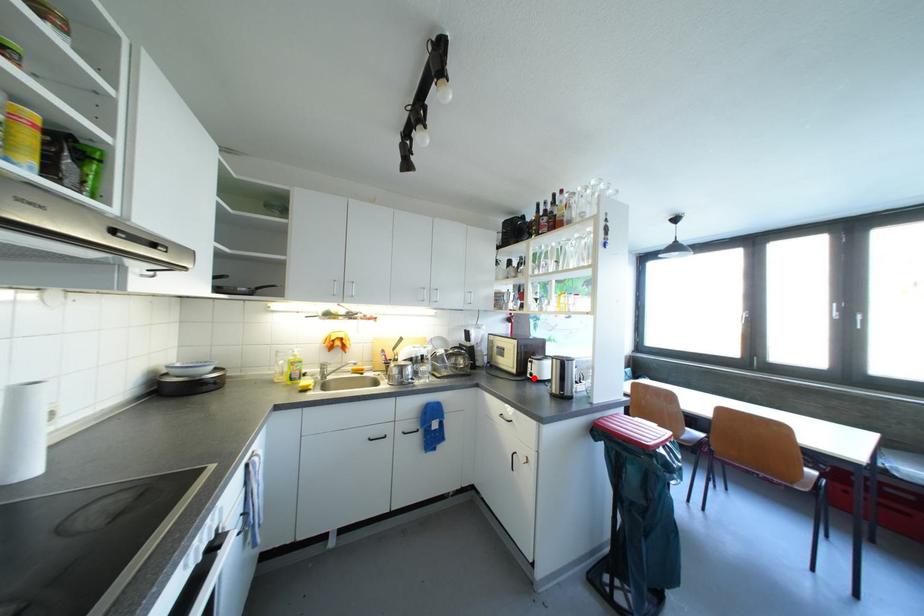
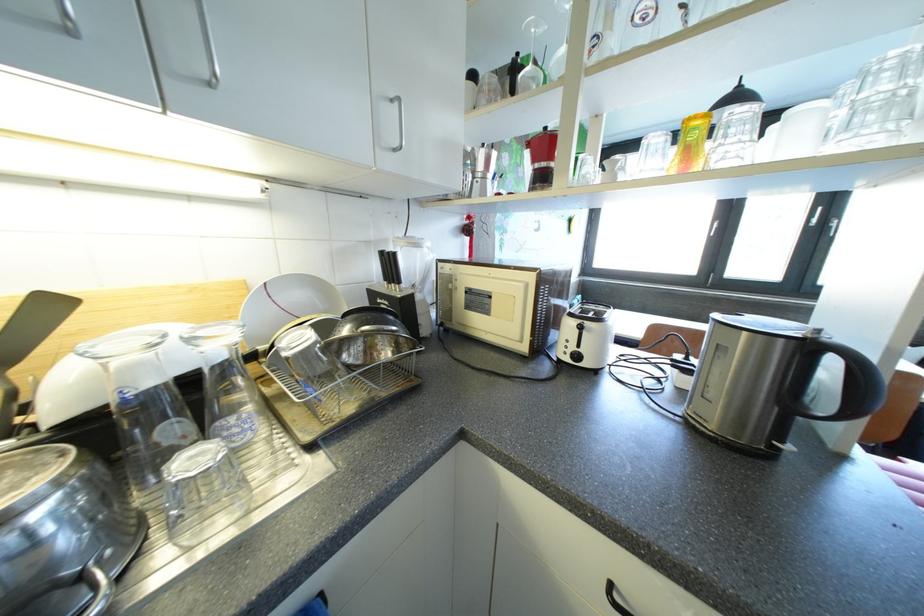
Locate, in the second image, the point that corresponds to the highlighted location in the first image.

(573, 362)